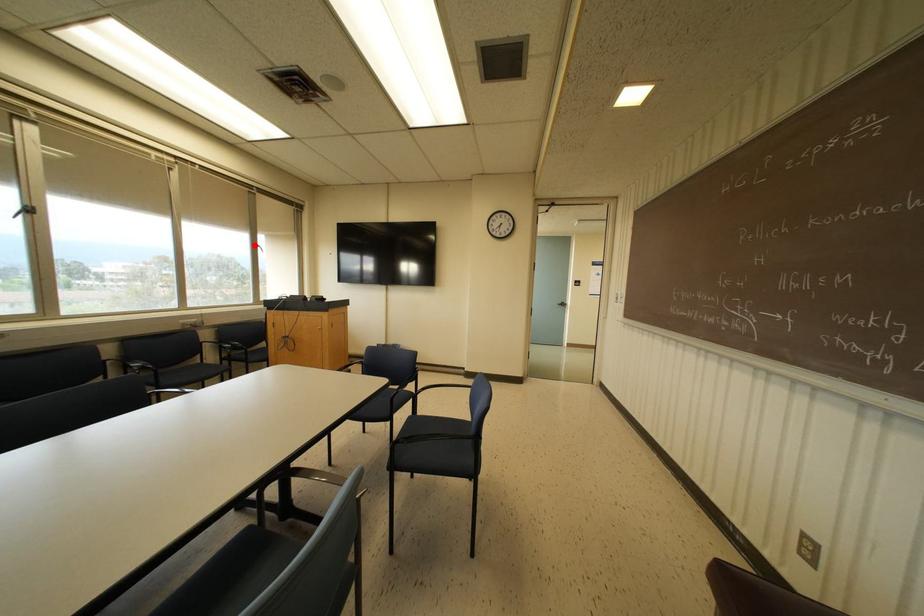
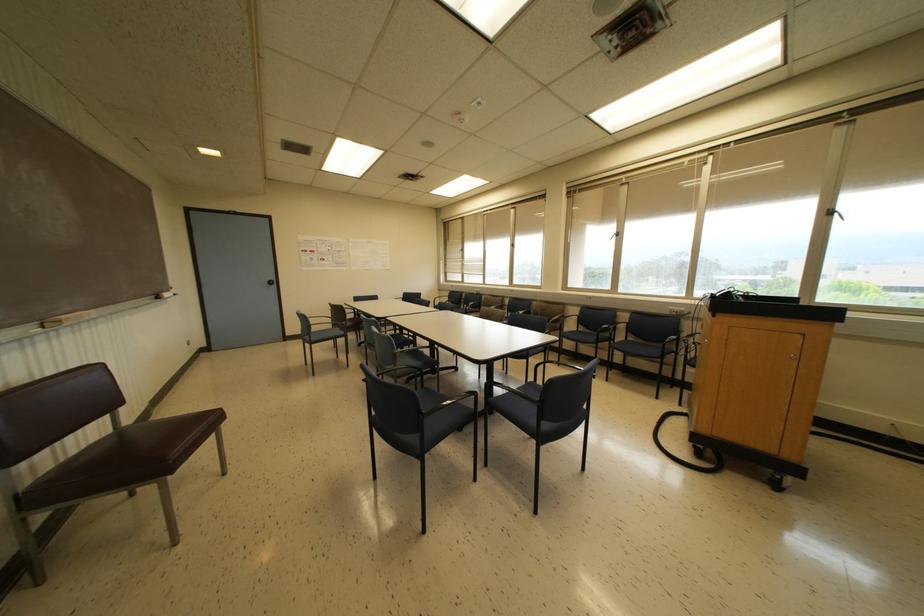
Where in the second image is the point corresponding to the highlighted location from the first image?

(827, 213)